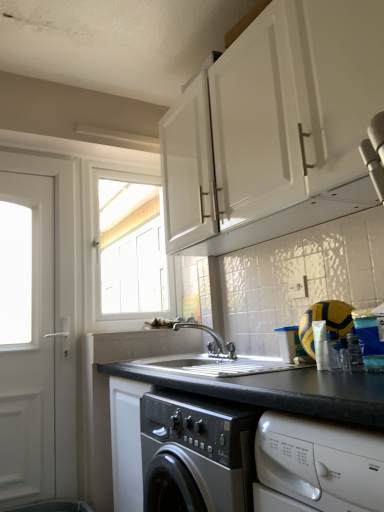
This screenshot has width=384, height=512. What do you see at coordinates (211, 342) in the screenshot? I see `silver metallic faucet at center` at bounding box center [211, 342].

This screenshot has height=512, width=384. What do you see at coordinates (26, 339) in the screenshot?
I see `white matte door at left` at bounding box center [26, 339].

Locate an element on the screen. silver metallic faucet at center is located at coordinates (211, 342).

Looking at the image, does white glossy window at upper center seem bigger or smaller compared to black granite countertop at center?

Clearly, white glossy window at upper center is smaller in size than black granite countertop at center.

Which object is thinner, white glossy window at upper center or black granite countertop at center?

With smaller width is white glossy window at upper center.

Considering the points (88, 293) and (303, 389), which point is in front, point (88, 293) or point (303, 389)?

The point (303, 389) is in front.

Looking at this image, from a real-world perspective, between black granite countertop at center and white glossy window at upper center, who is vertically lower?

black granite countertop at center.

Do you think black granite countertop at center is within white glossy window at upper center, or outside of it?

black granite countertop at center lies outside white glossy window at upper center.

Is black granite countertop at center directly adjacent to white glossy window at upper center?

black granite countertop at center and white glossy window at upper center are not in contact.

Does black granite countertop at center have a lesser height compared to white glossy window at upper center?

Yes.

From the image's perspective, is white glossy window at upper center above or below silver metallic faucet at center?

Clearly, from the image's perspective, white glossy window at upper center is above silver metallic faucet at center.

From a real-world perspective, is white glossy window at upper center positioned under silver metallic faucet at center based on gravity?

Actually, white glossy window at upper center is physically above silver metallic faucet at center in the real world.

In the scene shown: Are white glossy window at upper center and silver metallic faucet at center located far from each other?

Absolutely, white glossy window at upper center is distant from silver metallic faucet at center.

Does point (101, 226) come in front of point (194, 327)?

No, it is not.

From a real-world perspective, is silver metallic faucet at center on top of white matte cabinet at upper center?

No.

Considering the sizes of objects silver metallic faucet at center and white matte cabinet at upper center in the image provided, who is taller, silver metallic faucet at center or white matte cabinet at upper center?

With more height is white matte cabinet at upper center.

Relative to white matte cabinet at upper center, is silver metallic faucet at center in front or behind?

In the image, silver metallic faucet at center appears behind white matte cabinet at upper center.

Which is behind, point (215, 344) or point (231, 52)?

The point (215, 344) is more distant.

Is silver metallic faucet at center wider than white glossy window at upper center?

Correct, the width of silver metallic faucet at center exceeds that of white glossy window at upper center.

Considering the sizes of objects silver metallic faucet at center and white glossy window at upper center in the image provided, who is bigger, silver metallic faucet at center or white glossy window at upper center?

white glossy window at upper center.

Can white glossy window at upper center be found inside silver metallic faucet at center?

Definitely not — white glossy window at upper center is not inside silver metallic faucet at center.

The image size is (384, 512). Identify the location of window that appears on the left of silver metallic faucet at center. (128, 249).

Which of these two, white matte cabinet at upper center or white matte door at left, is smaller?

Smaller between the two is white matte door at left.

Would you consider white matte cabinet at upper center to be distant from white matte door at left?

white matte cabinet at upper center is positioned a significant distance from white matte door at left.

Can you confirm if white matte cabinet at upper center is wider than white matte door at left?

Yes, white matte cabinet at upper center is wider than white matte door at left.

From a real-world perspective, does white matte cabinet at upper center stand above white matte door at left?

Yes.

Which of these two, white matte door at left or black granite countertop at center, is bigger?

With larger size is black granite countertop at center.

Does white matte door at left turn towards black granite countertop at center?

No, white matte door at left is not facing towards black granite countertop at center.

Who is more distant, white matte door at left or black granite countertop at center?

white matte door at left is further from the camera.

Consider the image. Is white matte door at left beside black granite countertop at center?

No, white matte door at left is not with black granite countertop at center.

Find the location of a particular element. The width and height of the screenshot is (384, 512). window lying on the left of black granite countertop at center is located at coordinates (128, 249).

You are a GUI agent. You are given a task and a screenshot of the screen. Output one action in this format:
    pyautogui.click(x=<x>, y=<y>)
    Task: Click on the countertop below the white glossy window at upper center (from the image's perspective)
    Image resolution: width=384 pixels, height=512 pixels.
    Given the screenshot: What is the action you would take?
    pyautogui.click(x=268, y=387)

Estimate the real-world distances between objects in this image. Which object is closer to white glossy window at upper center, silver metallic faucet at center or white matte cabinet at upper center?

The object closer to white glossy window at upper center is silver metallic faucet at center.

Estimate the real-world distances between objects in this image. Which object is further from black granite countertop at center, white matte door at left or white glossy window at upper center?

Among the two, white glossy window at upper center is located further to black granite countertop at center.

From the image, which object appears to be nearer to silver metallic faucet at center, white glossy window at upper center or white matte door at left?

Based on the image, white matte door at left appears to be nearer to silver metallic faucet at center.

Considering their positions, is white matte door at left positioned closer to white glossy window at upper center than silver metallic faucet at center?

Among the two, white matte door at left is located nearer to white glossy window at upper center.

Looking at the image, which one is located further to white glossy window at upper center, white matte door at left or black granite countertop at center?

black granite countertop at center is positioned further to the anchor white glossy window at upper center.

Considering their positions, is white glossy window at upper center positioned further to white matte door at left than black granite countertop at center?

white glossy window at upper center is positioned further to the anchor white matte door at left.

Estimate the real-world distances between objects in this image. Which object is closer to white matte cabinet at upper center, silver metallic faucet at center or black granite countertop at center?

Among the two, black granite countertop at center is located nearer to white matte cabinet at upper center.

From the image, which object appears to be nearer to silver metallic faucet at center, white matte cabinet at upper center or white matte door at left?

Based on the image, white matte door at left appears to be nearer to silver metallic faucet at center.

The width and height of the screenshot is (384, 512). In order to click on countertop located between white matte door at left and white matte cabinet at upper center in the left-right direction in this screenshot , I will do `click(268, 387)`.

You are a GUI agent. You are given a task and a screenshot of the screen. Output one action in this format:
    pyautogui.click(x=<x>, y=<y>)
    Task: Click on the tap positioned between black granite countertop at center and white matte door at left from near to far
    The image size is (384, 512).
    Given the screenshot: What is the action you would take?
    pyautogui.click(x=211, y=342)

You are a GUI agent. You are given a task and a screenshot of the screen. Output one action in this format:
    pyautogui.click(x=<x>, y=<y>)
    Task: Click on the cabinetry located between black granite countertop at center and white glossy window at upper center in the depth direction
    This screenshot has width=384, height=512.
    Given the screenshot: What is the action you would take?
    pyautogui.click(x=292, y=117)

The height and width of the screenshot is (512, 384). I want to click on tap between white matte cabinet at upper center and black granite countertop at center vertically, so click(211, 342).